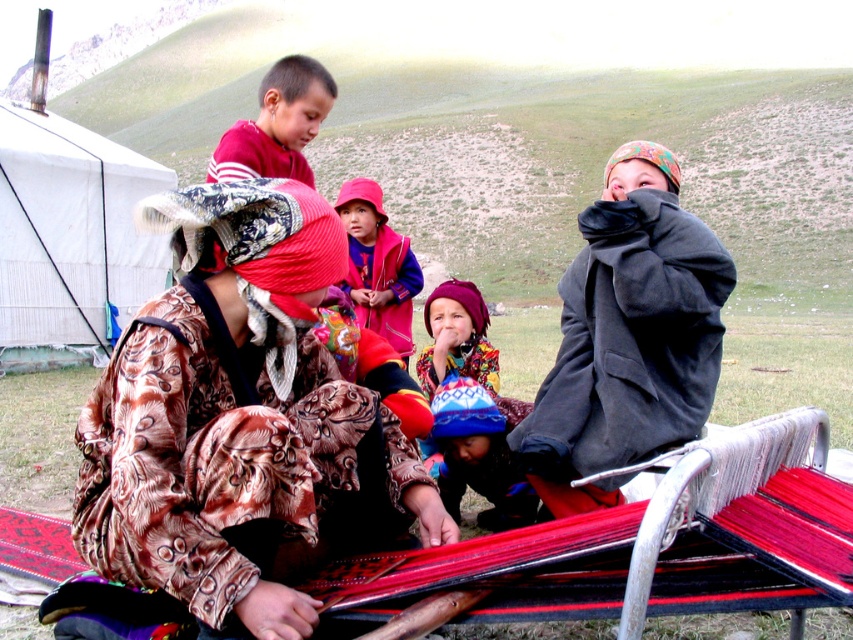
Between point (186, 416) and point (299, 177), which one is positioned behind?

Positioned behind is point (299, 177).

The height and width of the screenshot is (640, 853). In order to click on brown velvety robe at center in this screenshot , I will do `click(234, 467)`.

This screenshot has height=640, width=853. Describe the element at coordinates (480, 452) in the screenshot. I see `blue knitted hat at lower center` at that location.

Who is more distant from viewer, (x=459, y=444) or (x=438, y=368)?

Positioned behind is point (x=438, y=368).

Find the location of a particular element. blue knitted hat at lower center is located at coordinates (480, 452).

Locate an element on the screen. blue knitted hat at lower center is located at coordinates (480, 452).

Does brown velvety robe at center lie behind blue knitted hat at lower center?

No, it is not.

Who is lower down, brown velvety robe at center or blue knitted hat at lower center?

blue knitted hat at lower center

Identify the location of brown velvety robe at center. Image resolution: width=853 pixels, height=640 pixels. (234, 467).